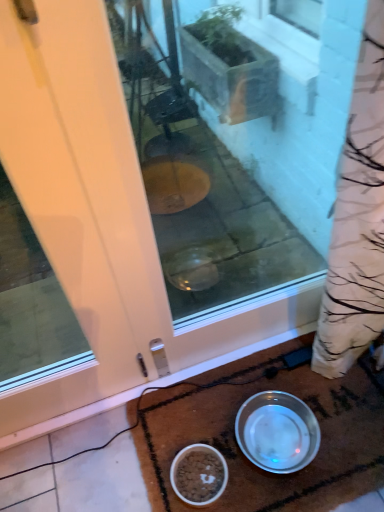
Question: Does white glossy bowl at lower center, the second bowl from the right, have a smaller size compared to silver metallic bowl at lower center, which ranks as the 2th bowl in left-to-right order?

Choices:
 (A) yes
 (B) no

Answer: (A)

Question: From a real-world perspective, is white glossy bowl at lower center, which is the 1th bowl in left-to-right order, over silver metallic bowl at lower center, arranged as the 1th bowl when viewed from the right?

Choices:
 (A) no
 (B) yes

Answer: (A)

Question: From the image's perspective, does white glossy bowl at lower center, the second bowl from the right, appear higher than silver metallic bowl at lower center, which ranks as the 2th bowl in left-to-right order?

Choices:
 (A) yes
 (B) no

Answer: (B)

Question: Is white glossy bowl at lower center, which is the 1th bowl in left-to-right order, facing towards silver metallic bowl at lower center, arranged as the 1th bowl when viewed from the right?

Choices:
 (A) yes
 (B) no

Answer: (B)

Question: Is white glossy bowl at lower center, which is the 1th bowl in left-to-right order, at the right side of silver metallic bowl at lower center, which ranks as the 2th bowl in left-to-right order?

Choices:
 (A) yes
 (B) no

Answer: (B)

Question: In terms of size, does white glossy door at center appear bigger or smaller than silver metallic bowl at lower center, arranged as the 1th bowl when viewed from the right?

Choices:
 (A) small
 (B) big

Answer: (B)

Question: Choose the correct answer: Is white glossy door at center inside silver metallic bowl at lower center, arranged as the 1th bowl when viewed from the right, or outside it?

Choices:
 (A) outside
 (B) inside

Answer: (A)

Question: From a real-world perspective, is white glossy door at center positioned above or below silver metallic bowl at lower center, arranged as the 1th bowl when viewed from the right?

Choices:
 (A) above
 (B) below

Answer: (A)

Question: Considering the positions of white glossy door at center and silver metallic bowl at lower center, arranged as the 1th bowl when viewed from the right, in the image, is white glossy door at center wider or thinner than silver metallic bowl at lower center, arranged as the 1th bowl when viewed from the right,?

Choices:
 (A) thin
 (B) wide

Answer: (A)

Question: Is silver metallic bowl at lower center, which ranks as the 2th bowl in left-to-right order, taller or shorter than white glossy door at center?

Choices:
 (A) tall
 (B) short

Answer: (B)

Question: Is silver metallic bowl at lower center, which ranks as the 2th bowl in left-to-right order, bigger or smaller than white glossy door at center?

Choices:
 (A) big
 (B) small

Answer: (B)

Question: Based on their positions, is silver metallic bowl at lower center, arranged as the 1th bowl when viewed from the right, located to the left or right of white glossy door at center?

Choices:
 (A) right
 (B) left

Answer: (A)

Question: Is point (289, 428) closer or farther from the camera than point (1, 411)?

Choices:
 (A) farther
 (B) closer

Answer: (A)

Question: Is point (218, 467) closer or farther from the camera than point (304, 428)?

Choices:
 (A) farther
 (B) closer

Answer: (B)

Question: Considering the positions of white glossy bowl at lower center, which is the 1th bowl in left-to-right order, and silver metallic bowl at lower center, arranged as the 1th bowl when viewed from the right, in the image, is white glossy bowl at lower center, which is the 1th bowl in left-to-right order, bigger or smaller than silver metallic bowl at lower center, arranged as the 1th bowl when viewed from the right,?

Choices:
 (A) big
 (B) small

Answer: (B)